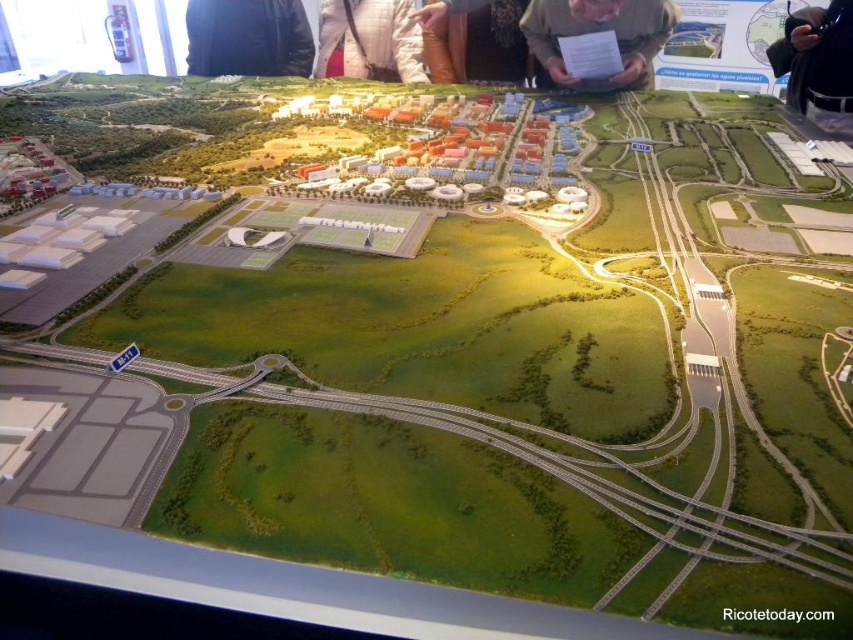
Who is lower down, matte brown paper at upper center or white cotton jacket at upper center?

matte brown paper at upper center is lower down.

Can you confirm if matte brown paper at upper center is bigger than white cotton jacket at upper center?

Correct, matte brown paper at upper center is larger in size than white cotton jacket at upper center.

The height and width of the screenshot is (640, 853). What do you see at coordinates (599, 32) in the screenshot?
I see `matte brown paper at upper center` at bounding box center [599, 32].

Locate an element on the screen. Image resolution: width=853 pixels, height=640 pixels. matte brown paper at upper center is located at coordinates (599, 32).

Does black leather jacket at upper center have a greater height compared to brown leather pants at upper center?

Yes, black leather jacket at upper center is taller than brown leather pants at upper center.

Is black leather jacket at upper center shorter than brown leather pants at upper center?

In fact, black leather jacket at upper center may be taller than brown leather pants at upper center.

In the scene shown: Who is more forward, (213, 72) or (428, 42)?

Point (428, 42) is in front.

I want to click on black leather jacket at upper center, so click(248, 36).

Does point (558, 22) lie behind point (456, 68)?

No.

Where is `matte brown paper at upper center`? The image size is (853, 640). matte brown paper at upper center is located at coordinates (599, 32).

Where is `matte brown paper at upper center`? matte brown paper at upper center is located at coordinates (599, 32).

Find the location of a particular element. The image size is (853, 640). matte brown paper at upper center is located at coordinates (599, 32).